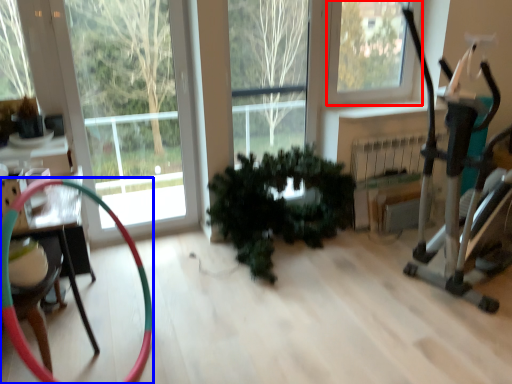
Question: Which point is further to the camera, window (highlighted by a red box) or garden hose (highlighted by a blue box)?

Choices:
 (A) window
 (B) garden hose

Answer: (A)